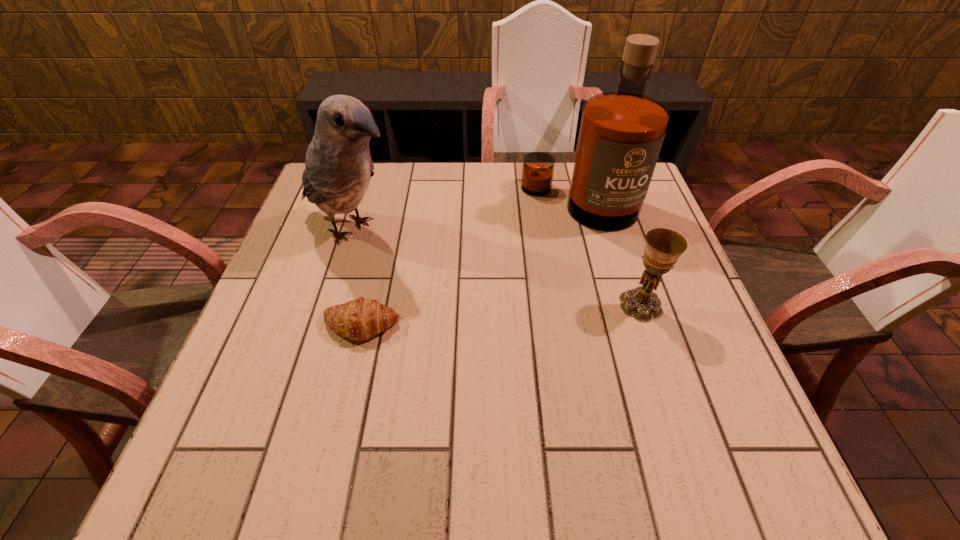
Locate an element on the screen. This screenshot has width=960, height=540. vacant area that lies between the liquor and the shortest object is located at coordinates (469, 265).

You are a GUI agent. You are given a task and a screenshot of the screen. Output one action in this format:
    pyautogui.click(x=<x>, y=<y>)
    Task: Click on the free area in between the chalice and the third shortest object
    
    Given the screenshot: What is the action you would take?
    pyautogui.click(x=496, y=267)

Image resolution: width=960 pixels, height=540 pixels. I want to click on vacant space that's between the liquor and the shortest object, so click(x=469, y=265).

This screenshot has width=960, height=540. I want to click on empty location between the second shortest object and the third shortest object, so click(496, 267).

Identify the location of object that is the third nearest to the shortest object. The image size is (960, 540). (663, 247).

Identify which object is the second closest to the shortest object. Please provide its 2D coordinates. Your answer should be formatted as a tuple, i.e. [(x, y)], where the tuple contains the x and y coordinates of a point satisfying the conditions above.

[(621, 133)]

Locate an element on the screen. blank area in the image that satisfies the following two spatial constraints: 1. on the front side of the parrot; 2. on the right side of the shortest object is located at coordinates (324, 325).

The height and width of the screenshot is (540, 960). In order to click on vacant area that satisfies the following two spatial constraints: 1. on the back side of the shortest object; 2. on the right side of the third tallest object in this screenshot , I will do `click(365, 305)`.